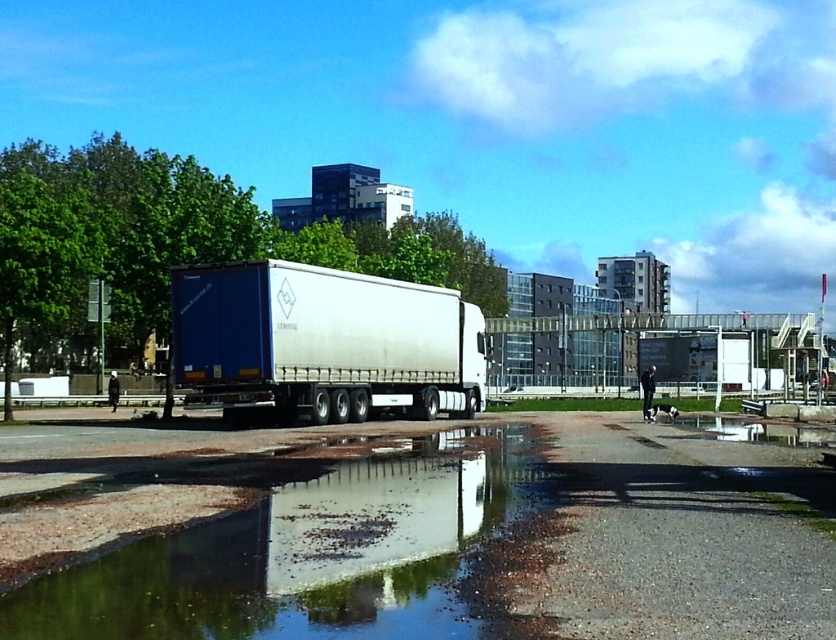
Question: Observing the image, what is the correct spatial positioning of clear water at lower center in reference to matte white trailer truck at center?

Choices:
 (A) right
 (B) left

Answer: (A)

Question: Does clear water at lower center have a smaller size compared to matte white trailer truck at center?

Choices:
 (A) yes
 (B) no

Answer: (A)

Question: Among these objects, which one is nearest to the camera?

Choices:
 (A) matte white trailer truck at center
 (B) clear water at lower center

Answer: (B)

Question: Can you confirm if clear water at lower center is positioned to the left of matte white trailer truck at center?

Choices:
 (A) yes
 (B) no

Answer: (B)

Question: Among these objects, which one is farthest from the camera?

Choices:
 (A) clear water at lower center
 (B) matte white trailer truck at center

Answer: (B)

Question: Among these objects, which one is farthest from the camera?

Choices:
 (A) matte white trailer truck at center
 (B) clear water at lower center

Answer: (A)